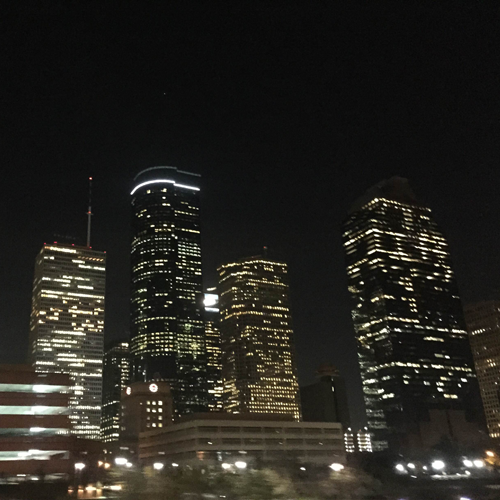
Where is `lighted window in high rise office building`? The image size is (500, 500). lighted window in high rise office building is located at coordinates (479, 330).